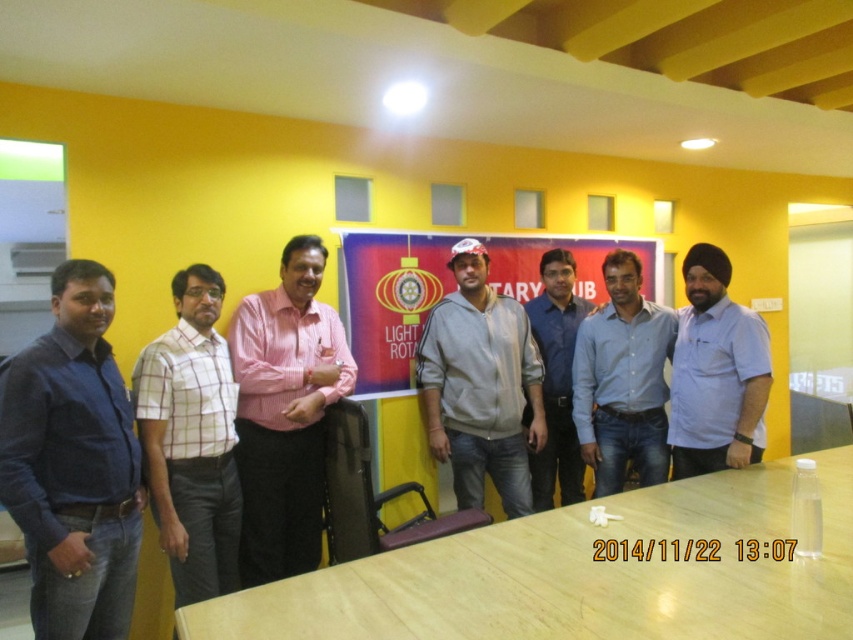
Question: Among these points, which one is farthest from the camera?

Choices:
 (A) (660, 397)
 (B) (79, 333)
 (C) (691, 355)

Answer: (A)

Question: Observing the image, what is the correct spatial positioning of gray fleece jacket at center in reference to blue shirt at center?

Choices:
 (A) right
 (B) left

Answer: (B)

Question: Which object is positioned closest to the pink shirt at center?

Choices:
 (A) gray fleece jacket at center
 (B) blue denim jeans at center

Answer: (A)

Question: Does blue shirt at left have a greater width compared to gray fleece jacket at center?

Choices:
 (A) no
 (B) yes

Answer: (A)

Question: Does pink shirt at center have a greater width compared to matte plastic banner at center?

Choices:
 (A) yes
 (B) no

Answer: (B)

Question: Which object is closer to the camera taking this photo?

Choices:
 (A) white checkered shirt at center
 (B) blue denim jeans at center
 (C) gray matte jacket at center

Answer: (A)